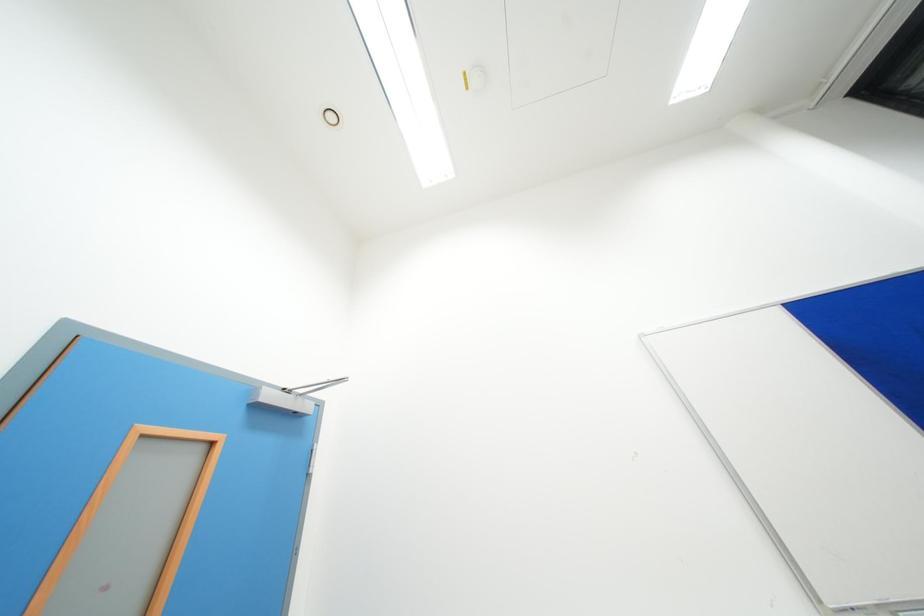
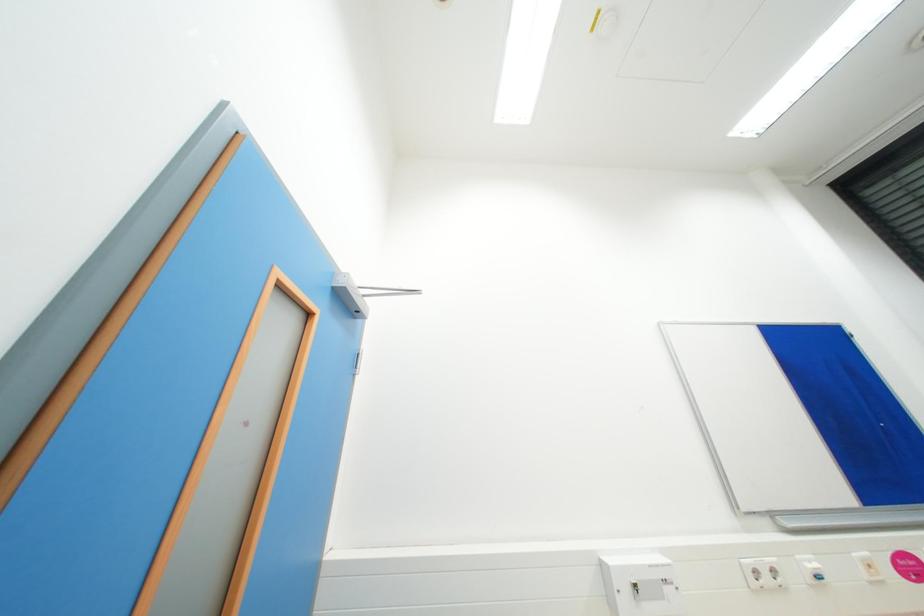
Question: The images are taken continuously from a first-person perspective. In which direction are you moving?

Choices:
 (A) Left
 (B) Right
 (C) Forward
 (D) Backward

Answer: (A)